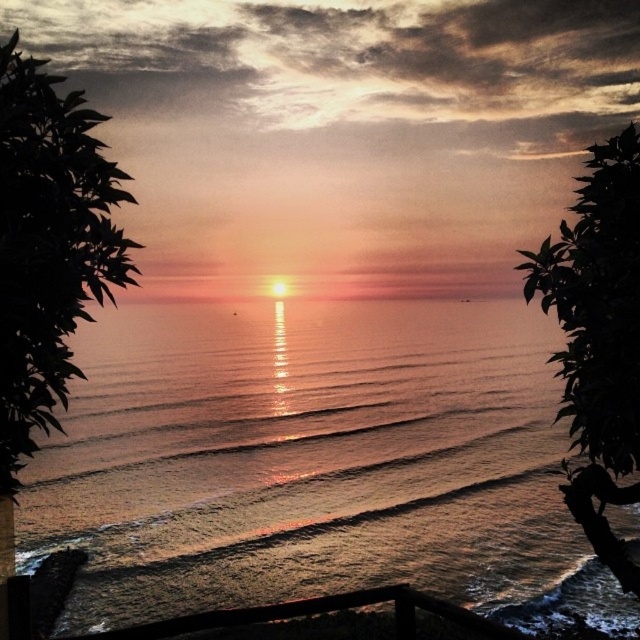
You are standing on a balcony overlooking the ocean and see two points in the scene. The first point is at coordinates point (355, 576) and the second is at point (20, 163). Which point is closer to you?

Point (355, 576) is further to the camera than point (20, 163), so the point closer to you is point (20, 163).

You are standing on a balcony overlooking the sunset and see the dark green leafy tree at left and the silhouette leafy tree at right. Which tree appears taller in the scene?

The dark green leafy tree at left appears taller than the silhouette leafy tree at right.

You are standing on a balcony and want to take a photo of the sunset. You notice the shiny metallic water at center and the silhouette leafy tree at right. Which object is closer to the top of the photo?

The shiny metallic water at center is located above the silhouette leafy tree at right, so it is closer to the top of the photo.